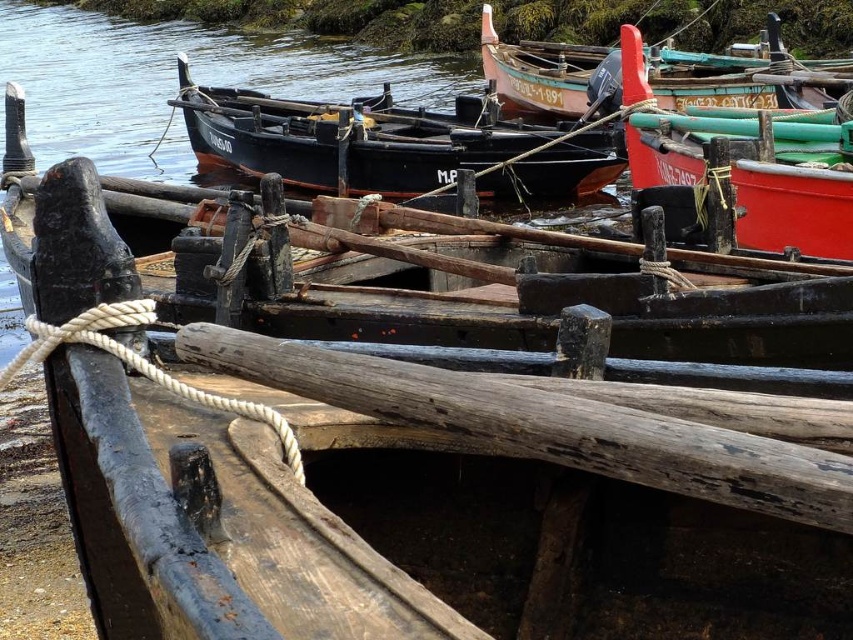
You are standing on the dock and want to board the boat that is taller. Which boat should you choose between the matte black boat at center and the wooden boat at upper right?

The wooden boat at upper right is taller than the matte black boat at center, so you should choose the wooden boat at upper right.